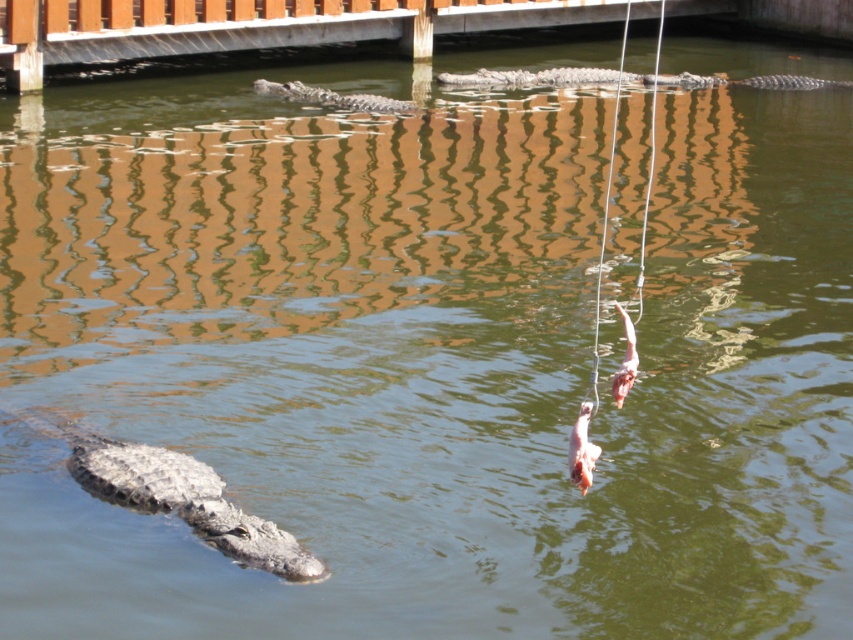
Question: Which object is farther from the camera taking this photo?

Choices:
 (A) gray scaly crocodile at lower left
 (B) gray textured crocodile at center
 (C) gray scaly crocodile at upper center

Answer: (C)

Question: Estimate the real-world distances between objects in this image. Which object is closer to the gray scaly crocodile at upper center?

Choices:
 (A) gray textured crocodile at center
 (B) gray scaly crocodile at lower left

Answer: (A)

Question: Does gray scaly crocodile at upper center appear under gray textured crocodile at center?

Choices:
 (A) yes
 (B) no

Answer: (B)

Question: Which point is closer to the camera taking this photo?

Choices:
 (A) (471, 83)
 (B) (277, 88)
 (C) (148, 492)

Answer: (C)

Question: From the image, what is the correct spatial relationship of gray scaly crocodile at lower left in relation to gray scaly crocodile at upper center?

Choices:
 (A) below
 (B) above

Answer: (A)

Question: Is gray scaly crocodile at lower left to the right of gray scaly crocodile at upper center from the viewer's perspective?

Choices:
 (A) yes
 (B) no

Answer: (B)